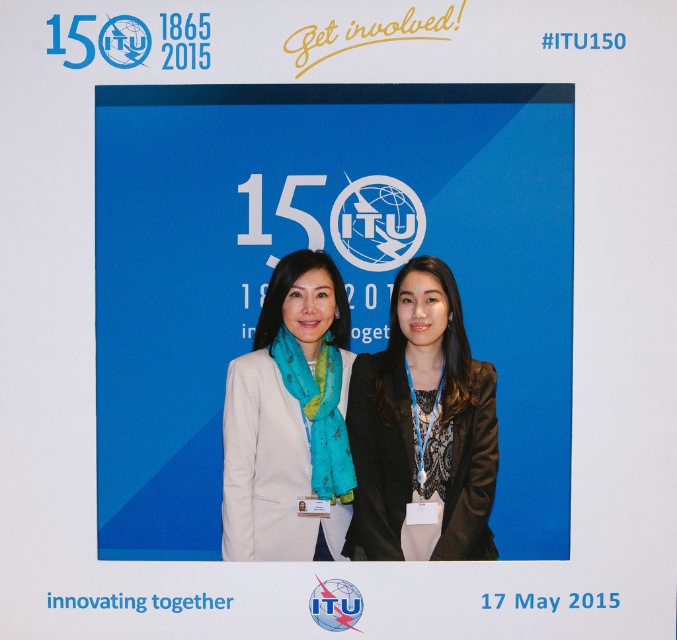
Is black lace blazer at center to the right of matte white blazer at center from the viewer's perspective?

Yes, black lace blazer at center is to the right of matte white blazer at center.

Can you confirm if black lace blazer at center is smaller than matte white blazer at center?

Yes.

Between point (473, 358) and point (307, 550), which one is positioned in front?

Positioned in front is point (307, 550).

The height and width of the screenshot is (640, 677). I want to click on black lace blazer at center, so click(414, 426).